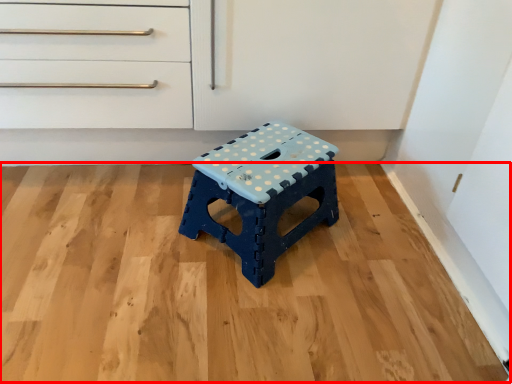
Question: Observing the image, what is the correct spatial positioning of hardwood (annotated by the red box) in reference to stool?

Choices:
 (A) left
 (B) right

Answer: (A)